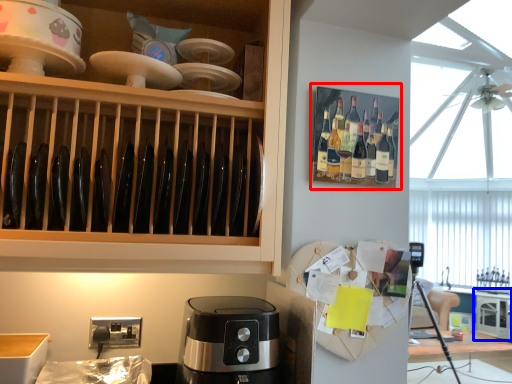
Question: Which of the following is the farthest to the observer, shelf (highlighted by a red box) or cabinetry (highlighted by a blue box)?

Choices:
 (A) shelf
 (B) cabinetry

Answer: (B)